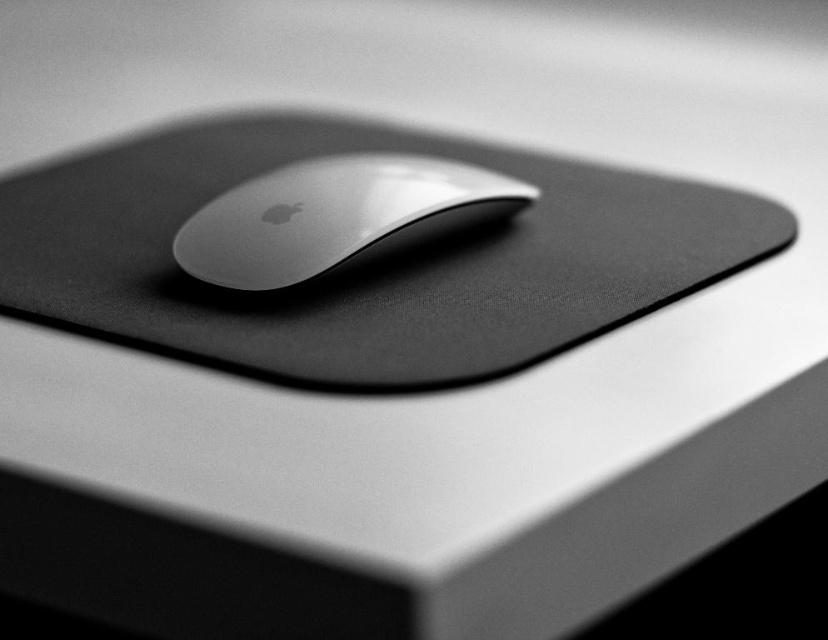
Question: Can you confirm if black matte mousepad at center is smaller than sleek silver mouse at center?

Choices:
 (A) no
 (B) yes

Answer: (A)

Question: Does black matte mousepad at center come in front of sleek silver mouse at center?

Choices:
 (A) no
 (B) yes

Answer: (B)

Question: Among these objects, which one is nearest to the camera?

Choices:
 (A) sleek silver mouse at center
 (B) black matte mousepad at center

Answer: (B)

Question: Is black matte mousepad at center positioned in front of sleek silver mouse at center?

Choices:
 (A) no
 (B) yes

Answer: (B)

Question: Which point is farther to the camera?

Choices:
 (A) sleek silver mouse at center
 (B) black matte mousepad at center

Answer: (A)